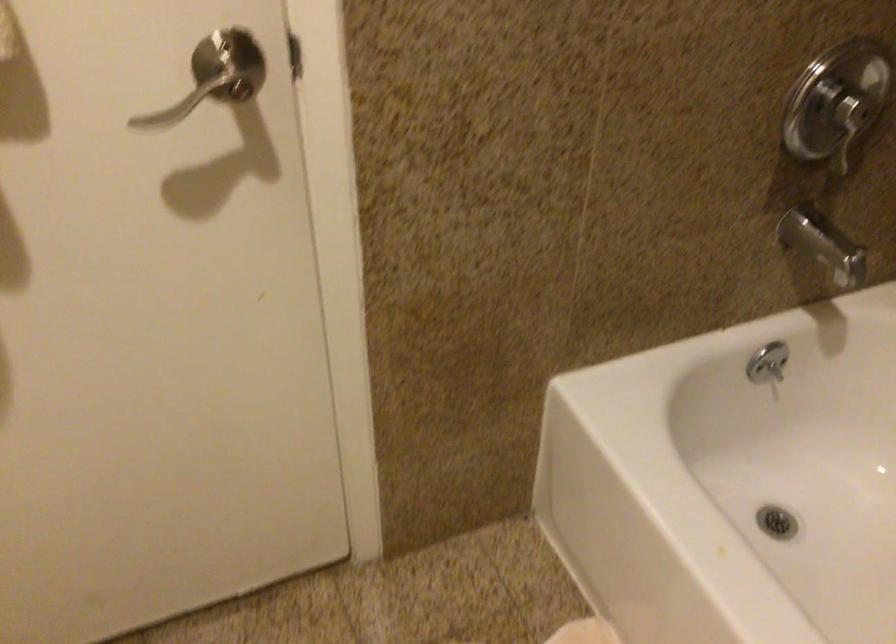
Where would you pull the shower handle? Please return your answer as a coordinate pair (x, y).

(849, 127)